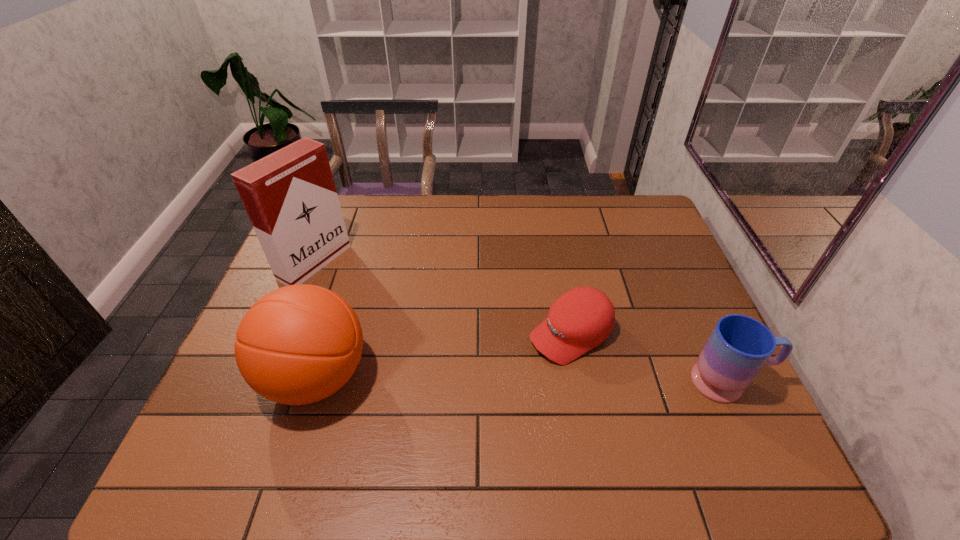
The width and height of the screenshot is (960, 540). I want to click on object located in the near right corner section of the desktop, so coord(739,346).

In the image, there is a desktop. At what (x,y) coordinates should I click in order to perform the action: click on vacant space at the far edge. Please return your answer as a coordinate pair (x, y). Looking at the image, I should click on coord(576,199).

This screenshot has height=540, width=960. In the image, there is a desktop. In order to click on free space at the near edge in this screenshot , I will do `click(402, 425)`.

Image resolution: width=960 pixels, height=540 pixels. I want to click on vacant space at the right edge, so click(672, 348).

Locate an element on the screen. This screenshot has width=960, height=540. vacant space at the near right corner of the desktop is located at coordinates (703, 427).

Find the location of `free point between the second shortest object and the third shortest object`. free point between the second shortest object and the third shortest object is located at coordinates (522, 379).

I want to click on free area in between the second tallest object and the rightmost object, so click(x=522, y=379).

The height and width of the screenshot is (540, 960). In order to click on unoccupied area between the second tallest object and the cap in this screenshot , I will do `click(444, 355)`.

What are the coordinates of `vacant area that lies between the cap and the rightmost object` in the screenshot? It's located at (650, 358).

Locate an element on the screen. This screenshot has width=960, height=540. empty space that is in between the third shortest object and the second object from right to left is located at coordinates (444, 355).